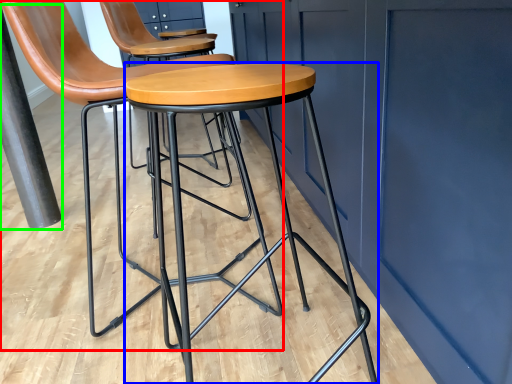
Question: Estimate the real-world distances between objects in this image. Which object is closer to chair (highlighted by a red box), stool (highlighted by a blue box) or pole (highlighted by a green box)?

Choices:
 (A) stool
 (B) pole

Answer: (A)